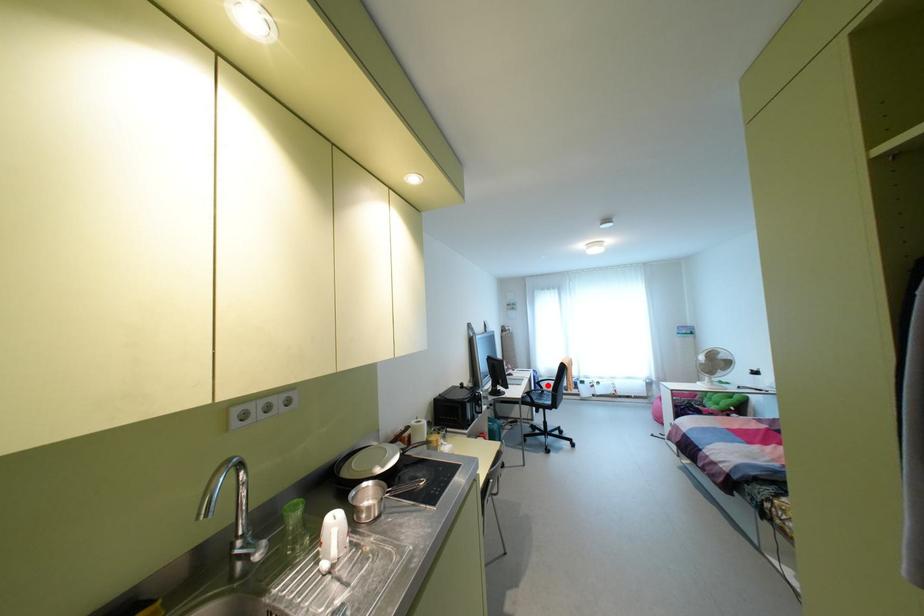
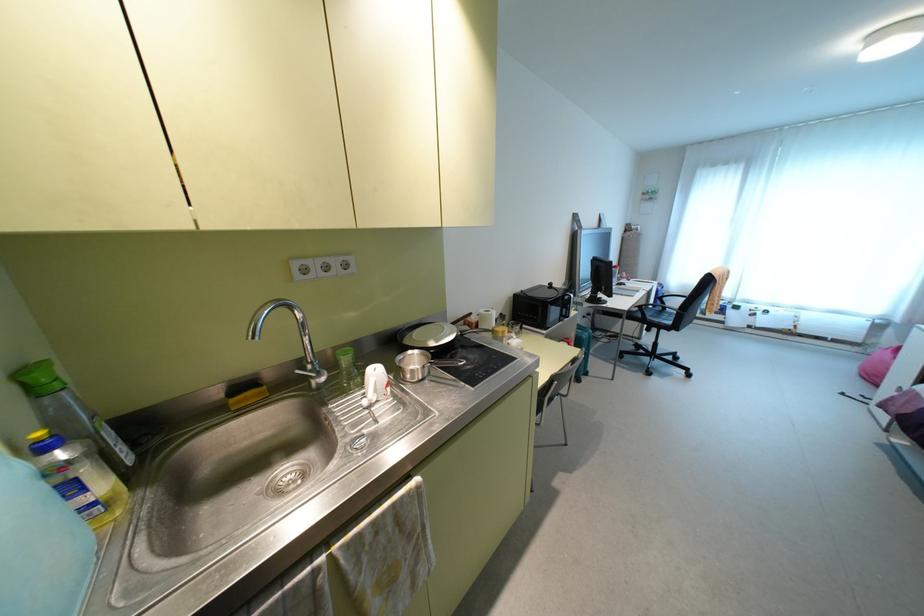
In the second image, find the point that corresponds to the highlighted location in the first image.

(674, 302)